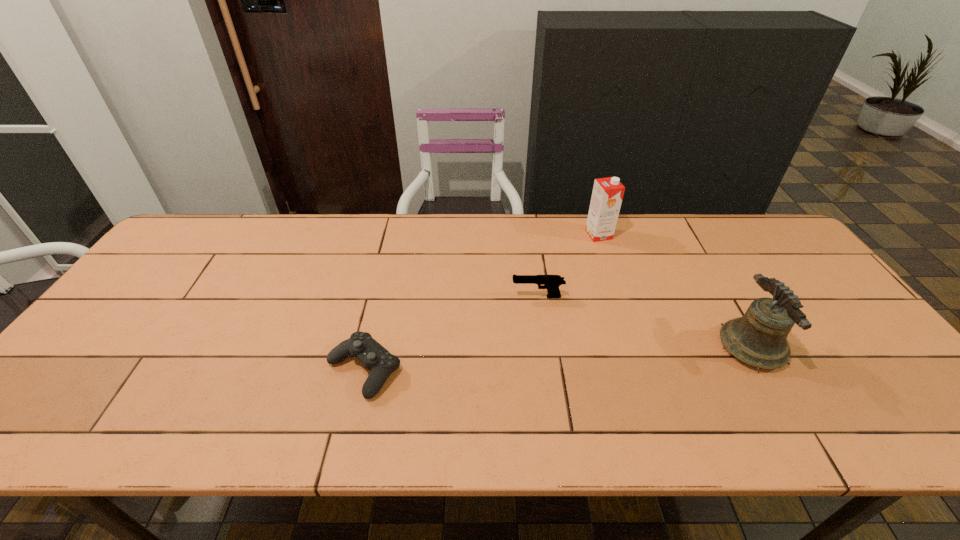
The width and height of the screenshot is (960, 540). In order to click on free space between the second farthest object and the rightmost object in this screenshot , I will do `click(644, 322)`.

The width and height of the screenshot is (960, 540). In order to click on free space between the third nearest object and the rightmost object in this screenshot , I will do `click(644, 322)`.

Locate an element on the screen. vacant point located between the pistol and the rightmost object is located at coordinates (644, 322).

Identify the location of vacant region between the farthest object and the pistol. The height and width of the screenshot is (540, 960). (568, 266).

I want to click on blank region between the bell and the carton, so click(675, 291).

The width and height of the screenshot is (960, 540). I want to click on free space between the third tallest object and the farthest object, so click(568, 266).

Find the location of a particular element. empty location between the rightmost object and the second farthest object is located at coordinates (644, 322).

Where is `free space between the control and the rightmost object`? free space between the control and the rightmost object is located at coordinates (558, 359).

Identify which object is the second nearest to the rightmost object. Please provide its 2D coordinates. Your answer should be formatted as a tuple, i.e. [(x, y)], where the tuple contains the x and y coordinates of a point satisfying the conditions above.

[(607, 195)]

In order to click on the second closest object to the third object from right to left in this screenshot , I will do [381, 363].